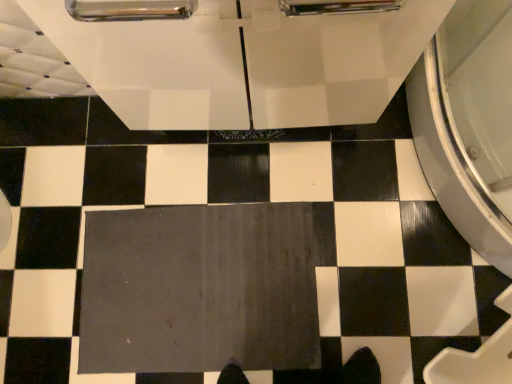
I want to click on unoccupied space behind dark gray rubber bath mat at center, so click(150, 165).